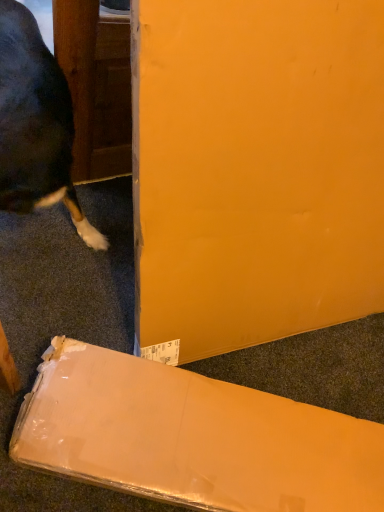
This screenshot has width=384, height=512. Identify the location of free spot above matte cardboard box at lower center (from a real-world perspective). (179, 423).